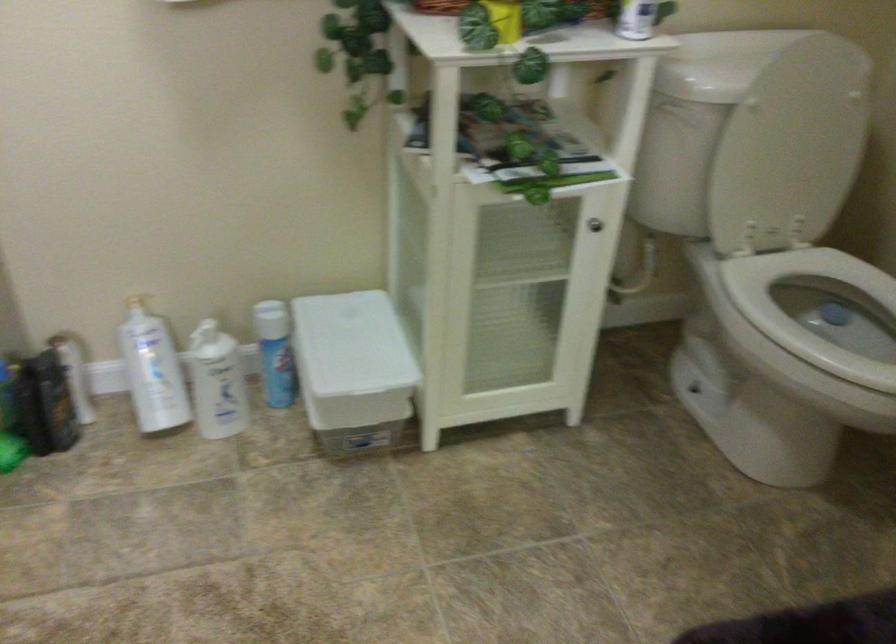
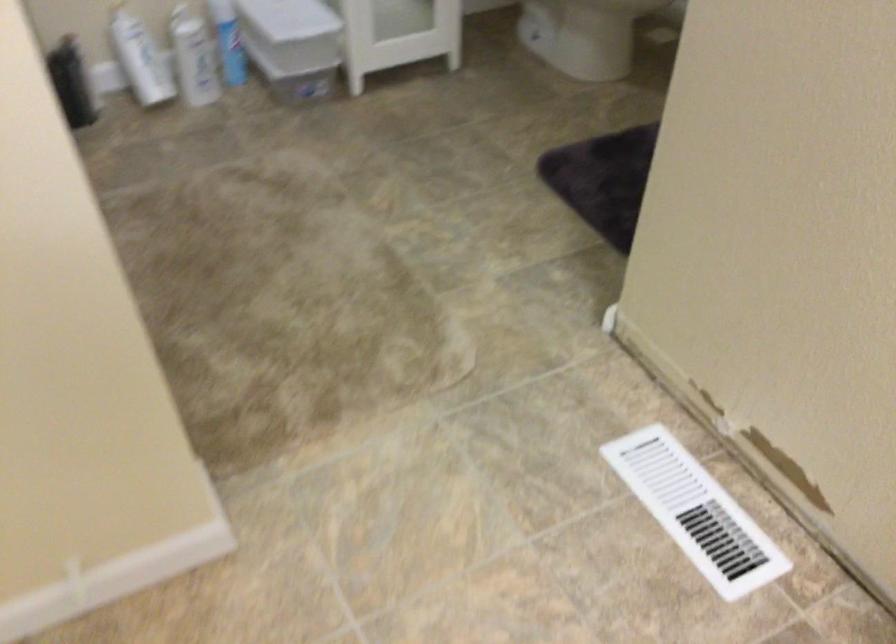
Locate, in the second image, the point that corresponds to pixel 261 361 in the first image.

(228, 41)